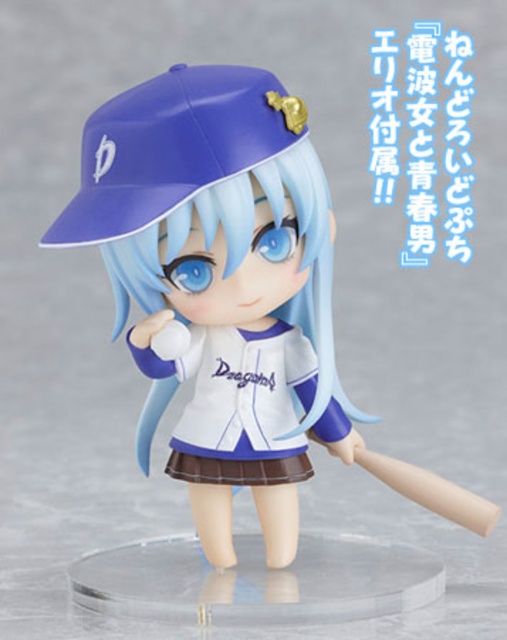
Based on the photo, you are an athlete preparing for a game and notice two baseball caps in your locker. The white matte baseball cap at upper center and the matte blue baseball cap at upper center are both there. If your head is 12 inches wide, will both caps fit side by side on your head without overlapping?

The white matte baseball cap at upper center and the matte blue baseball cap at upper center are 3.03 inches apart from each other. Since your head is 12 inches wide, there is enough space to fit both caps side by side without overlapping.

You are a collector who wants to display the matte blue baseball cap at upper center and the white matte baseball uniform at center together on a shelf. The shelf has a maximum width of 6 inches. Can both items fit side by side on the shelf without overlapping?

The matte blue baseball cap at upper center and white matte baseball uniform at center are 5.64 inches apart, so they can fit side by side on the 6 inch shelf since the total width required is less than the shelf width.